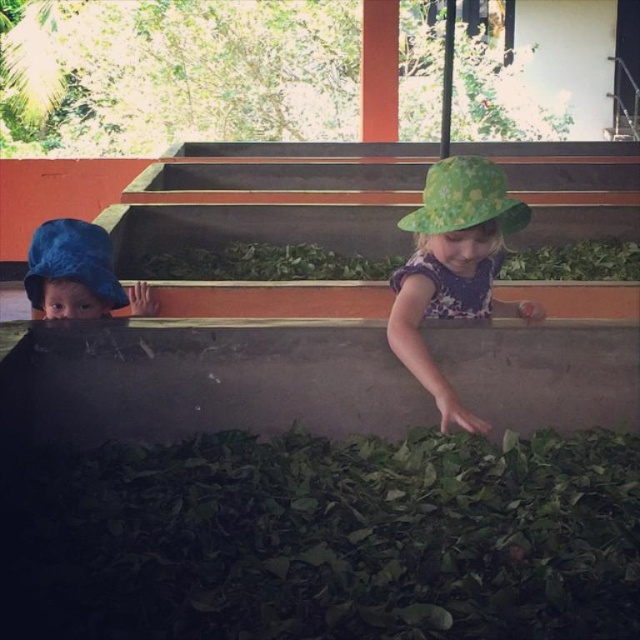
Between green floral hat at center and green fabric hat at upper right, which one is positioned lower?

Positioned lower is green floral hat at center.

Can you confirm if green floral hat at center is shorter than green fabric hat at upper right?

No, green floral hat at center is not shorter than green fabric hat at upper right.

You are a GUI agent. You are given a task and a screenshot of the screen. Output one action in this format:
    pyautogui.click(x=<x>, y=<y>)
    Task: Click on the green floral hat at center
    
    Given the screenshot: What is the action you would take?
    pyautogui.click(x=452, y=268)

In the scene shown: Which is above, green floral hat at center or blue fabric hat at left?

Positioned higher is blue fabric hat at left.

Which is behind, point (401, 310) or point (70, 256)?

Point (70, 256)

Which is in front, point (486, 304) or point (56, 225)?

Positioned in front is point (56, 225).

The height and width of the screenshot is (640, 640). I want to click on green floral hat at center, so click(x=452, y=268).

Does green fabric hat at upper right appear on the left side of blue fabric hat at left?

No, green fabric hat at upper right is not to the left of blue fabric hat at left.

Can you confirm if green fabric hat at upper right is positioned to the right of blue fabric hat at left?

Yes, green fabric hat at upper right is to the right of blue fabric hat at left.

Image resolution: width=640 pixels, height=640 pixels. I want to click on green fabric hat at upper right, so click(465, 198).